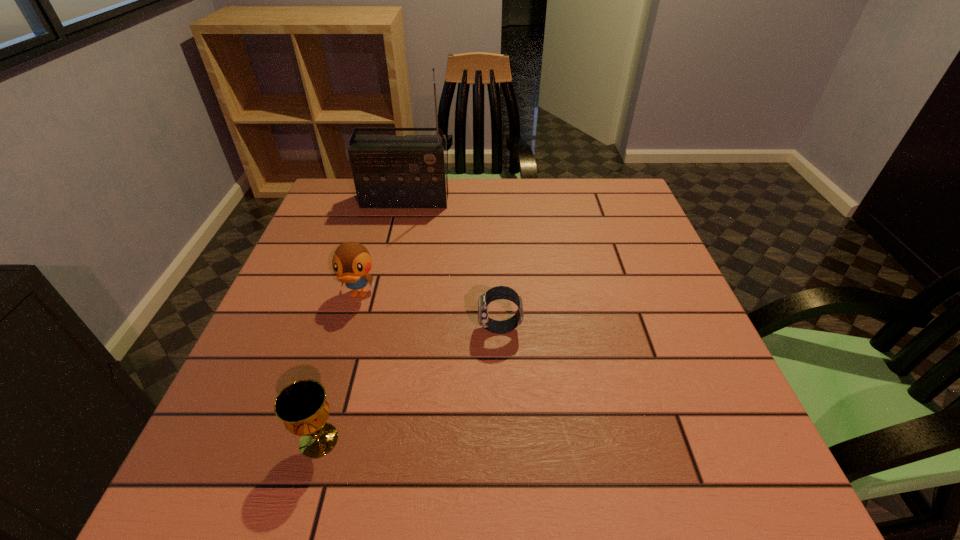
Identify the location of the farthest object. This screenshot has width=960, height=540. (389, 171).

The image size is (960, 540). In order to click on radio receiver in this screenshot , I will do `click(389, 171)`.

Where is `the second farthest object`? The image size is (960, 540). the second farthest object is located at coordinates (352, 262).

This screenshot has width=960, height=540. In order to click on the nearest object in this screenshot , I will do `click(302, 406)`.

Locate an element on the screen. the rightmost object is located at coordinates (499, 292).

Image resolution: width=960 pixels, height=540 pixels. I want to click on watch, so click(499, 292).

Identify the location of vacant space located on the front panel of the radio receiver. This screenshot has width=960, height=540. (398, 228).

I want to click on vacant space situated 0.270m on the front-facing side of the duck, so click(x=321, y=424).

You are a GUI agent. You are given a task and a screenshot of the screen. Output one action in this format:
    pyautogui.click(x=<x>, y=<y>)
    Task: Click on the vacant space located on the right of the chalice
    
    Given the screenshot: What is the action you would take?
    pyautogui.click(x=389, y=440)

Image resolution: width=960 pixels, height=540 pixels. I want to click on vacant space located on the face of the second nearest object, so click(397, 329).